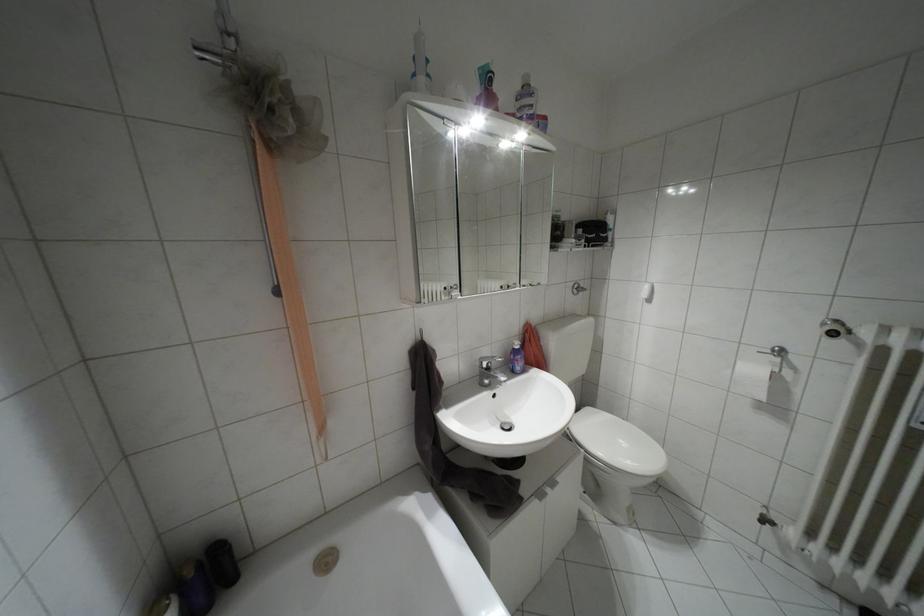
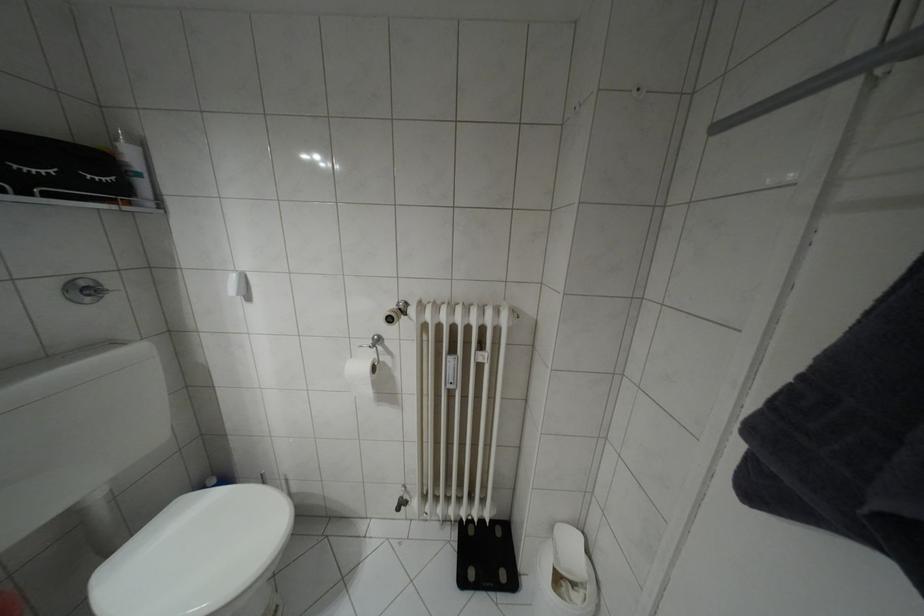
Where in the second image is the point corresponding to point 575,285 from the first image?

(81, 284)